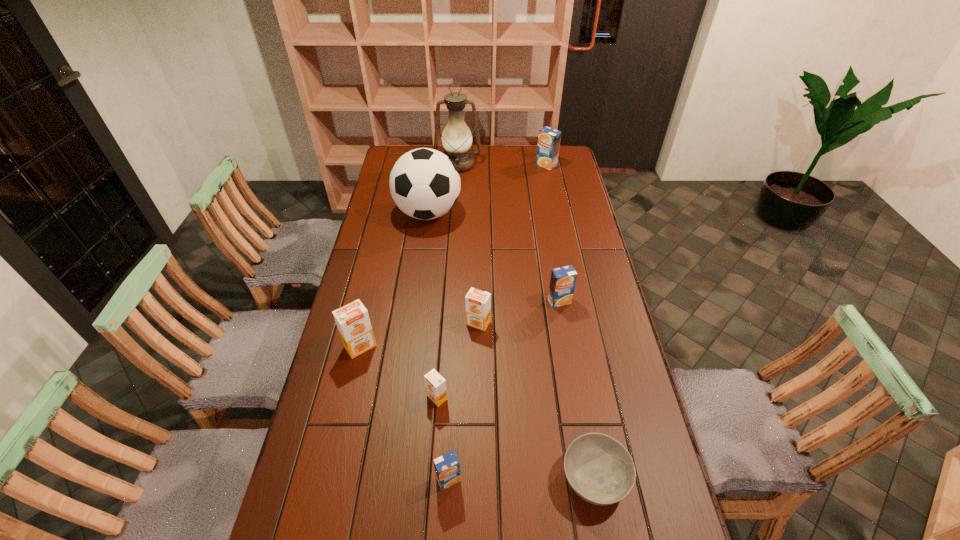
Point out which blue orange_juice is positioned as the second nearest to the nearest blue orange_juice. Please provide its 2D coordinates. Your answer should be formatted as a tuple, i.e. [(x, y)], where the tuple contains the x and y coordinates of a point satisfying the conditions above.

[(549, 139)]

You are a GUI agent. You are given a task and a screenshot of the screen. Output one action in this format:
    pyautogui.click(x=<x>, y=<y>)
    Task: Click on the orange orange juice that is the second closest to the shortest object
    
    Given the screenshot: What is the action you would take?
    pyautogui.click(x=478, y=303)

Point out which orange orange juice is positioned as the third nearest to the bowl. Please provide its 2D coordinates. Your answer should be formatted as a tuple, i.e. [(x, y)], where the tuple contains the x and y coordinates of a point satisfying the conditions above.

[(352, 320)]

Where is `free space that satisfies the following two spatial constraints: 1. on the front side of the biggest blue orange_juice; 2. on the right side of the tallest object`? Image resolution: width=960 pixels, height=540 pixels. free space that satisfies the following two spatial constraints: 1. on the front side of the biggest blue orange_juice; 2. on the right side of the tallest object is located at coordinates (458, 165).

Where is `vacant point that satisfies the following two spatial constraints: 1. on the front side of the fifth farthest object; 2. on the right side of the tallest object`? This screenshot has height=540, width=960. vacant point that satisfies the following two spatial constraints: 1. on the front side of the fifth farthest object; 2. on the right side of the tallest object is located at coordinates (447, 323).